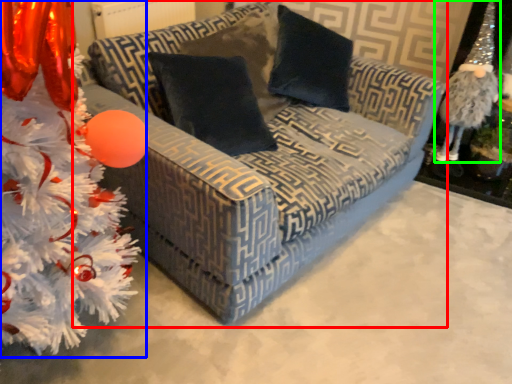
Question: Based on their relative distances, which object is farther from studio couch (highlighted by a red box)? Choose from christmas tree (highlighted by a blue box) and toy (highlighted by a green box).

Choices:
 (A) christmas tree
 (B) toy

Answer: (B)